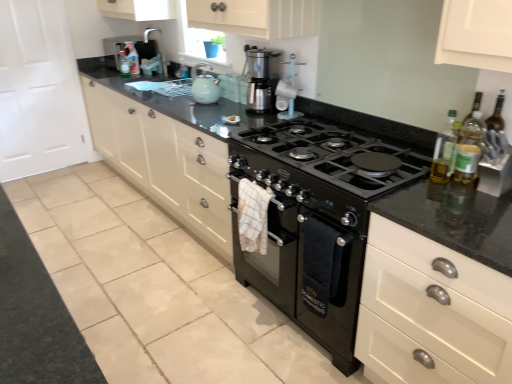
The image size is (512, 384). What do you see at coordinates (204, 85) in the screenshot?
I see `matte ceramic kettle at upper center` at bounding box center [204, 85].

Measure the distance between point (196,100) and camera.

2.81 meters.

I want to click on matte white coffee maker at upper center, so click(290, 112).

The height and width of the screenshot is (384, 512). What do you see at coordinates (290, 112) in the screenshot?
I see `matte white coffee maker at upper center` at bounding box center [290, 112].

Where is `matte ceramic kettle at upper center`? The width and height of the screenshot is (512, 384). matte ceramic kettle at upper center is located at coordinates (204, 85).

In terms of height, does translucent plastic bottle at upper center, positioned as the 3th bottle in bottom-to-top order, look taller or shorter compared to matte ceramic kettle at upper center?

In the image, translucent plastic bottle at upper center, positioned as the 3th bottle in bottom-to-top order, appears to be shorter than matte ceramic kettle at upper center.

Which object is wider, translucent plastic bottle at upper center, positioned as the 3th bottle in bottom-to-top order, or matte ceramic kettle at upper center?

Wider between the two is matte ceramic kettle at upper center.

Could matte ceramic kettle at upper center be considered to be inside translucent plastic bottle at upper center, the third bottle in the left-to-right sequence?

No, matte ceramic kettle at upper center is not a part of translucent plastic bottle at upper center, the third bottle in the left-to-right sequence.

Would you say translucent plastic bottle at upper center, positioned as the 3th bottle in bottom-to-top order, is inside or outside black matte oven at center?

translucent plastic bottle at upper center, positioned as the 3th bottle in bottom-to-top order, is outside black matte oven at center.

From the picture: Which of these two, translucent plastic bottle at upper center, the 3th bottle viewed from the back, or black matte oven at center, is wider?

Wider between the two is black matte oven at center.

From the image's perspective, which is below, translucent plastic bottle at upper center, positioned as the 3th bottle in bottom-to-top order, or black matte oven at center?

black matte oven at center appears lower in the image.

Consider the image. From a real-world perspective, is translucent plastic bottle at upper center, the third bottle positioned from the front, on black matte oven at center?

Indeed, from a real-world perspective, translucent plastic bottle at upper center, the third bottle positioned from the front, stands above black matte oven at center.

Does black matte oven at center appear on the left side of translucent plastic bottle at right, which appears as the 2th bottle when ordered from the bottom?

Yes.

In the scene shown: Is black matte oven at center positioned with its back to translucent plastic bottle at right, acting as the 2th bottle starting from the front?

No, black matte oven at center's orientation is not away from translucent plastic bottle at right, acting as the 2th bottle starting from the front.

Could you measure the distance between black matte oven at center and translucent plastic bottle at right, which appears as the 2th bottle when ordered from the bottom?

black matte oven at center is 59.49 centimeters away from translucent plastic bottle at right, which appears as the 2th bottle when ordered from the bottom.

Could you tell me if translucent plastic bottle at right, acting as the 2th bottle starting from the front, is turned towards translucent plastic bottle at upper center, which ranks as the 2th bottle in back-to-front order?

No, translucent plastic bottle at right, acting as the 2th bottle starting from the front, is not aimed at translucent plastic bottle at upper center, which ranks as the 2th bottle in back-to-front order.

Who is taller, translucent plastic bottle at right, acting as the second bottle starting from the right, or translucent plastic bottle at upper center, arranged as the second bottle when viewed from the top?

Standing taller between the two is translucent plastic bottle at right, acting as the second bottle starting from the right.

Is the surface of translucent plastic bottle at right, the fourth bottle in the left-to-right sequence, in direct contact with translucent plastic bottle at upper center, which ranks as the fourth bottle in bottom-to-top order?

There is a gap between translucent plastic bottle at right, the fourth bottle in the left-to-right sequence, and translucent plastic bottle at upper center, which ranks as the fourth bottle in bottom-to-top order.

From a real-world perspective, is matte white coffee maker at upper center positioned above or below translucent plastic bottle at upper center, the third bottle in the left-to-right sequence?

matte white coffee maker at upper center is above translucent plastic bottle at upper center, the third bottle in the left-to-right sequence.

Considering the relative sizes of matte white coffee maker at upper center and translucent plastic bottle at upper center, the 3th bottle viewed from the back, in the image provided, is matte white coffee maker at upper center shorter than translucent plastic bottle at upper center, the 3th bottle viewed from the back,?

No.

Considering the sizes of objects matte white coffee maker at upper center and translucent plastic bottle at upper center, which is the third bottle from top to bottom, in the image provided, who is bigger, matte white coffee maker at upper center or translucent plastic bottle at upper center, which is the third bottle from top to bottom,?

Bigger between the two is matte white coffee maker at upper center.

Considering the relative sizes of translucent plastic bottle at upper center, the fifth bottle when ordered from bottom to top, and matte ceramic kettle at upper center in the image provided, is translucent plastic bottle at upper center, the fifth bottle when ordered from bottom to top, bigger than matte ceramic kettle at upper center?

Actually, translucent plastic bottle at upper center, the fifth bottle when ordered from bottom to top, might be smaller than matte ceramic kettle at upper center.

Which is more distant, (129,54) or (200,95)?

Positioned behind is point (129,54).

Can you confirm if translucent plastic bottle at upper center, arranged as the first bottle when viewed from the top, is shorter than matte ceramic kettle at upper center?

No.

From the image's perspective, is translucent plastic bottle at upper center, acting as the second bottle starting from the left, located above or below matte ceramic kettle at upper center?

Based on their image positions, translucent plastic bottle at upper center, acting as the second bottle starting from the left, is located above matte ceramic kettle at upper center.

Consider the image. Which of these two, translucent plastic bottle at upper center, the third bottle positioned from the front, or translucent plastic bottle at right, acting as the fourth bottle starting from the back, is bigger?

translucent plastic bottle at right, acting as the fourth bottle starting from the back.

Measure the distance from translucent plastic bottle at upper center, which is counted as the 3th bottle, starting from the right, to translucent plastic bottle at right, acting as the 4th bottle starting from the top.

translucent plastic bottle at upper center, which is counted as the 3th bottle, starting from the right, and translucent plastic bottle at right, acting as the 4th bottle starting from the top, are 2.25 meters apart from each other.

Which is further, (184,70) or (453,132)?

Point (184,70)

From a real-world perspective, is translucent plastic bottle at upper center, the 3th bottle viewed from the back, on top of translucent plastic bottle at right, acting as the 2th bottle starting from the front?

No, from a real-world perspective, translucent plastic bottle at upper center, the 3th bottle viewed from the back, is not on top of translucent plastic bottle at right, acting as the 2th bottle starting from the front.

The height and width of the screenshot is (384, 512). In order to click on the 1st bottle positioned above the matte ceramic kettle at upper center (from the image's perspective) in this screenshot , I will do `click(182, 71)`.

Identify the location of oven located underneath the translucent plastic bottle at upper center, the third bottle in the left-to-right sequence (from a real-world perspective). (320, 263).

Which object lies nearer to the anchor point matte white cabinets at center, translucent plastic bottle at upper center, arranged as the first bottle when viewed from the top, or brushed metal faucet at upper center?

translucent plastic bottle at upper center, arranged as the first bottle when viewed from the top, is closer to matte white cabinets at center.

Based on their spatial positions, is matte ceramic kettle at upper center or clear glass bottle at right, the 5th bottle in the left-to-right sequence, further from matte white coffee maker at upper center?

clear glass bottle at right, the 5th bottle in the left-to-right sequence.

Looking at the image, which one is located further to satin silver coffee maker at center, black matte oven at center or translucent plastic bottle at upper center, the third bottle positioned from the front?

translucent plastic bottle at upper center, the third bottle positioned from the front, is further to satin silver coffee maker at center.

From the image, which object appears to be farther from brushed metal faucet at upper center, black matte oven at center or matte white cabinets at center?

black matte oven at center is positioned further to the anchor brushed metal faucet at upper center.

Looking at the image, which one is located further to translucent plastic bottle at upper center, arranged as the first bottle when viewed from the top, matte white coffee maker at upper center or translucent plastic bottle at upper center, the third bottle positioned from the front?

matte white coffee maker at upper center is further to translucent plastic bottle at upper center, arranged as the first bottle when viewed from the top.

From the image, which object appears to be farther from black matte oven at center, translucent plastic bottle at upper center, which is counted as the 3th bottle, starting from the right, or matte white cabinets at center?

Among the two, translucent plastic bottle at upper center, which is counted as the 3th bottle, starting from the right, is located further to black matte oven at center.

Estimate the real-world distances between objects in this image. Which object is closer to translucent plastic bottle at upper center, the fourth bottle from the front, translucent plastic bottle at right, the fourth bottle in the left-to-right sequence, or satin silver coffee maker at center?

The object closer to translucent plastic bottle at upper center, the fourth bottle from the front, is satin silver coffee maker at center.

Estimate the real-world distances between objects in this image. Which object is closer to matte white cabinets at center, translucent plastic bottle at right, acting as the 4th bottle starting from the top, or translucent plastic bottle at upper center, which ranks as the 5th bottle in front-to-back order?

Based on the image, translucent plastic bottle at upper center, which ranks as the 5th bottle in front-to-back order, appears to be nearer to matte white cabinets at center.

Where is `home appliance located between matte white cabinets at center and translucent plastic bottle at upper center, positioned as the 3th bottle in bottom-to-top order, in the depth direction`? home appliance located between matte white cabinets at center and translucent plastic bottle at upper center, positioned as the 3th bottle in bottom-to-top order, in the depth direction is located at coordinates (260, 81).

Identify the location of kitchen appliance between translucent plastic bottle at upper center, which is counted as the 1th bottle, starting from the left, and matte white coffee maker at upper center. The width and height of the screenshot is (512, 384). (204, 85).

The image size is (512, 384). Identify the location of home appliance between matte ceramic kettle at upper center and black matte oven at center in the up-down direction. (260, 81).

Find the location of a particular element. Image resolution: width=512 pixels, height=384 pixels. faucet between translucent plastic bottle at right, acting as the second bottle starting from the right, and translucent plastic bottle at upper center, the fifth bottle when ordered from bottom to top, in the front-back direction is located at coordinates (158, 46).